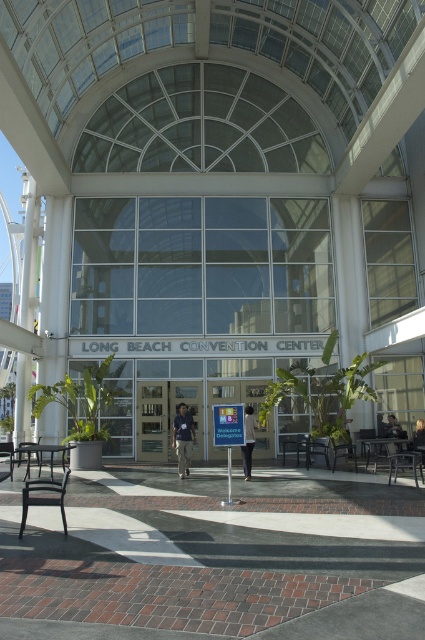
You are a security guard at the Long Beach Convention Center. You notice two items left unattended near the entrance. The blue denim jeans at center and the light brown leather jacket at lower right. According to the scene description, which item is placed on top of the other?

The blue denim jeans at center is positioned over the light brown leather jacket at lower right, so the jeans are on top of the jacket.